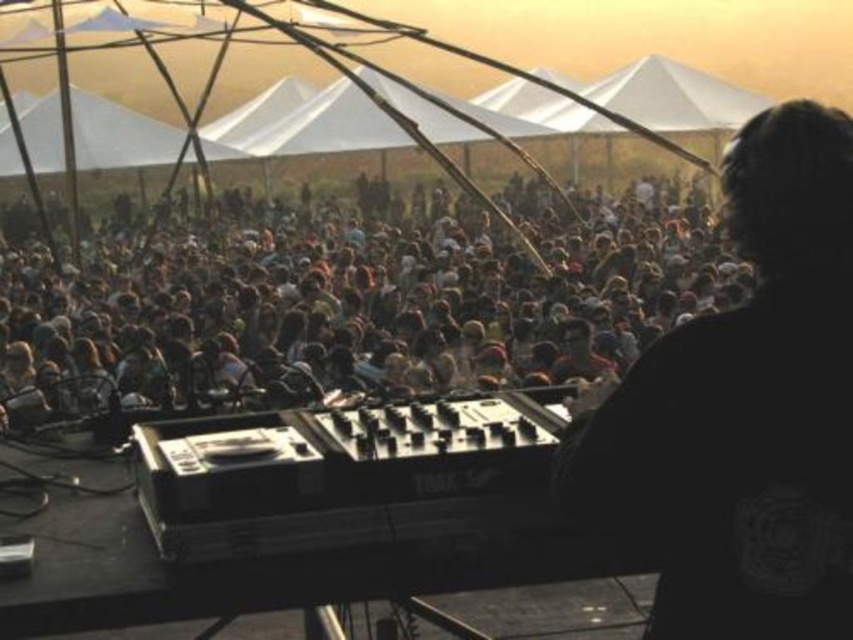
Question: Which point is farther from the camera taking this photo?

Choices:
 (A) (703, 237)
 (B) (660, 618)

Answer: (A)

Question: Is brown hair at center to the left of black matte headphones at right from the viewer's perspective?

Choices:
 (A) no
 (B) yes

Answer: (B)

Question: Among these objects, which one is nearest to the camera?

Choices:
 (A) black matte headphones at right
 (B) brown hair at center

Answer: (A)

Question: In this image, where is brown hair at center located relative to black matte headphones at right?

Choices:
 (A) above
 (B) below

Answer: (A)

Question: Is brown hair at center to the left of black matte headphones at right from the viewer's perspective?

Choices:
 (A) no
 (B) yes

Answer: (B)